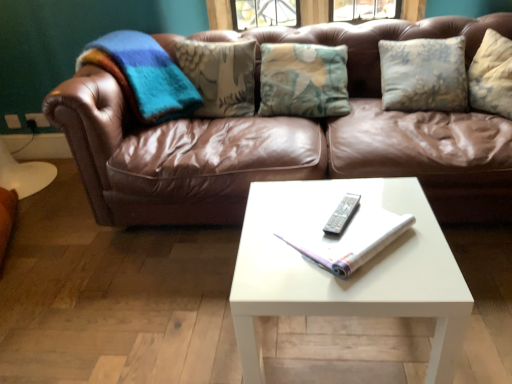
In order to click on free space to the right of white paper book at center in this screenshot , I will do `click(412, 228)`.